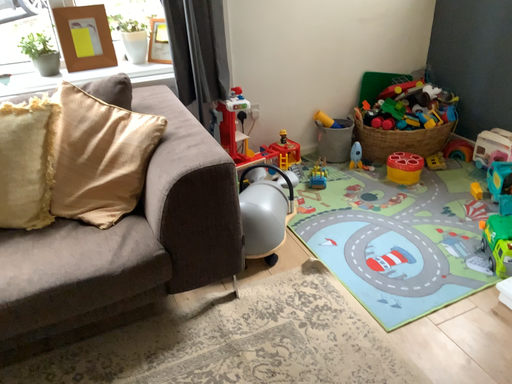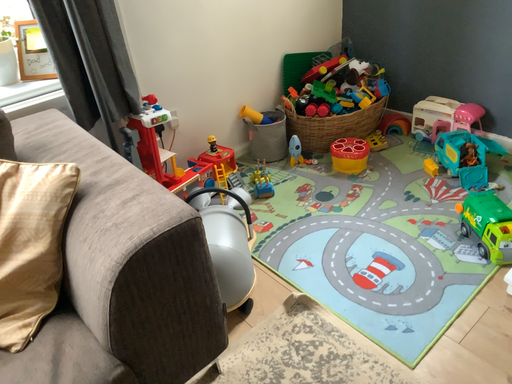
Question: Which way did the camera rotate in the video?

Choices:
 (A) rotated left
 (B) rotated right

Answer: (B)